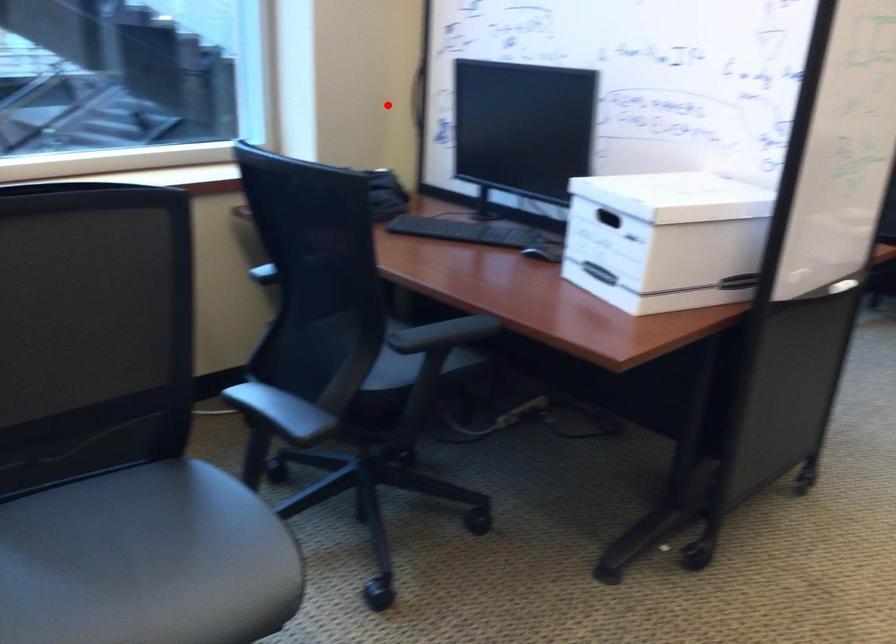
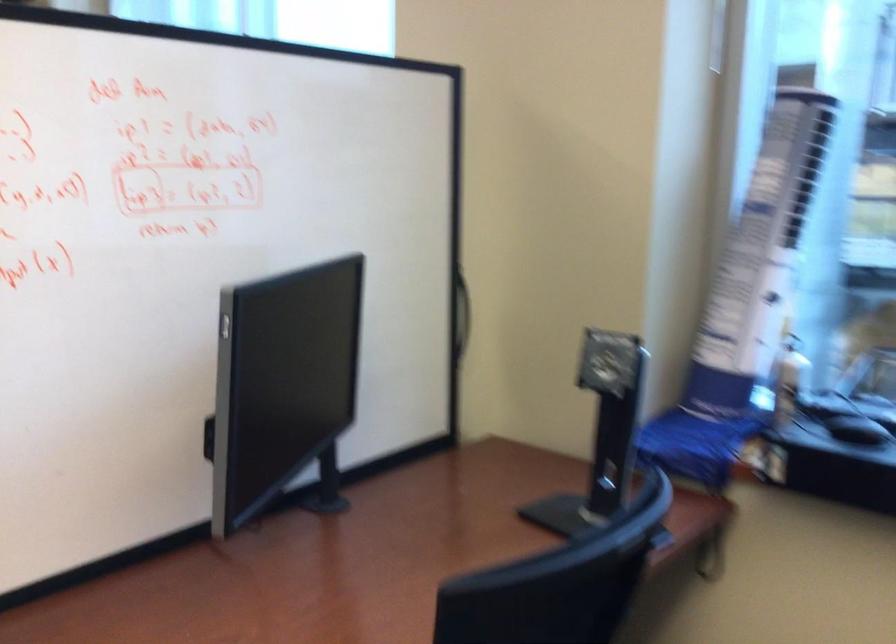
The point at the highlighted location is marked in the first image. Where is the corresponding point in the second image?

(461, 313)